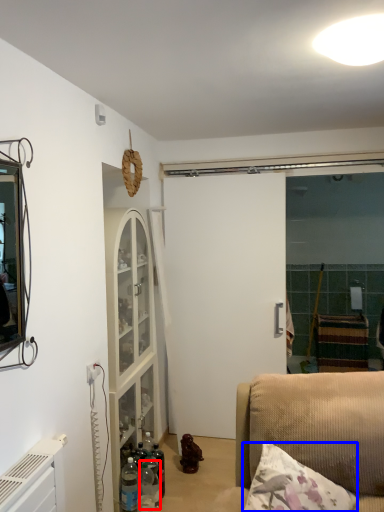
Question: Among these objects, which one is nearest to the camera, bottle (highlighted by a red box) or pillow (highlighted by a blue box)?

Choices:
 (A) bottle
 (B) pillow

Answer: (B)